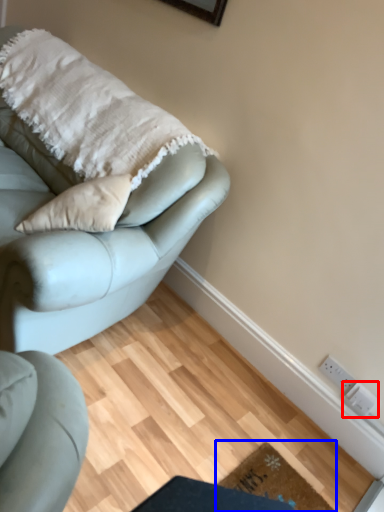
Question: Which object appears farthest to the camera in this image, electric outlet (highlighted by a red box) or doormat (highlighted by a blue box)?

Choices:
 (A) electric outlet
 (B) doormat

Answer: (A)